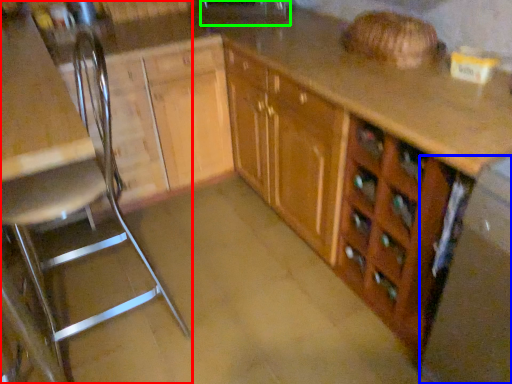
Question: Considering the real-world distances, which object is farthest from chair (highlighted by a red box)? appliance (highlighted by a blue box) or sink (highlighted by a green box)?

Choices:
 (A) appliance
 (B) sink

Answer: (A)